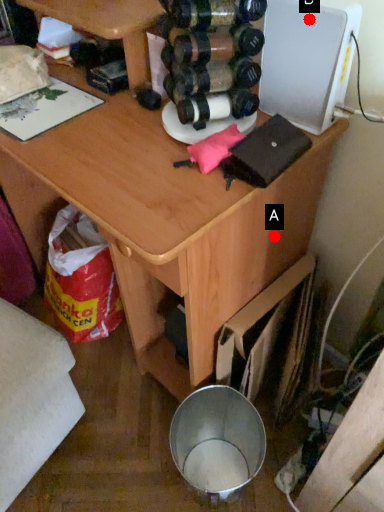
Question: Two points are circled on the image, labeled by A and B beside each circle. Which point is closer to the camera?

Choices:
 (A) A is closer
 (B) B is closer

Answer: (B)